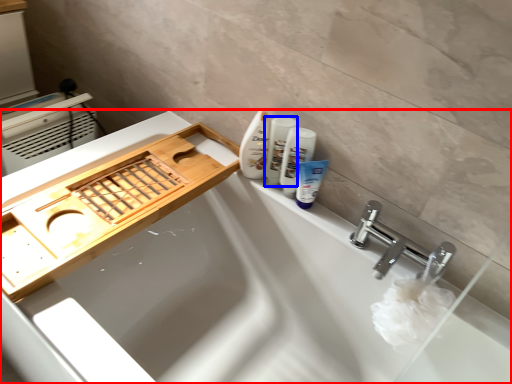
Question: Which point is closer to the camera, bathtub (highlighted by a red box) or toiletry (highlighted by a blue box)?

Choices:
 (A) bathtub
 (B) toiletry

Answer: (A)